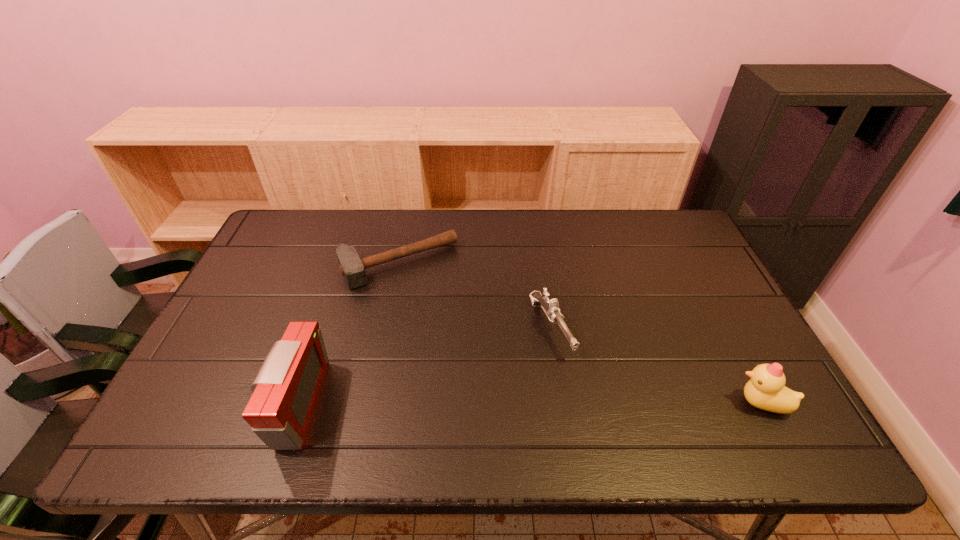
This screenshot has height=540, width=960. I want to click on free spot on the desktop that is between the tallest object and the rightmost object and is positioned aimed along the barrel of the second object from right to left, so click(x=595, y=403).

You are a GUI agent. You are given a task and a screenshot of the screen. Output one action in this format:
    pyautogui.click(x=<x>, y=<y>)
    Task: Click on the free spot on the desktop that is between the camera and the rightmost object and is positioned on the striking surface of the shortest object
    Image resolution: width=960 pixels, height=540 pixels.
    Given the screenshot: What is the action you would take?
    pyautogui.click(x=478, y=403)